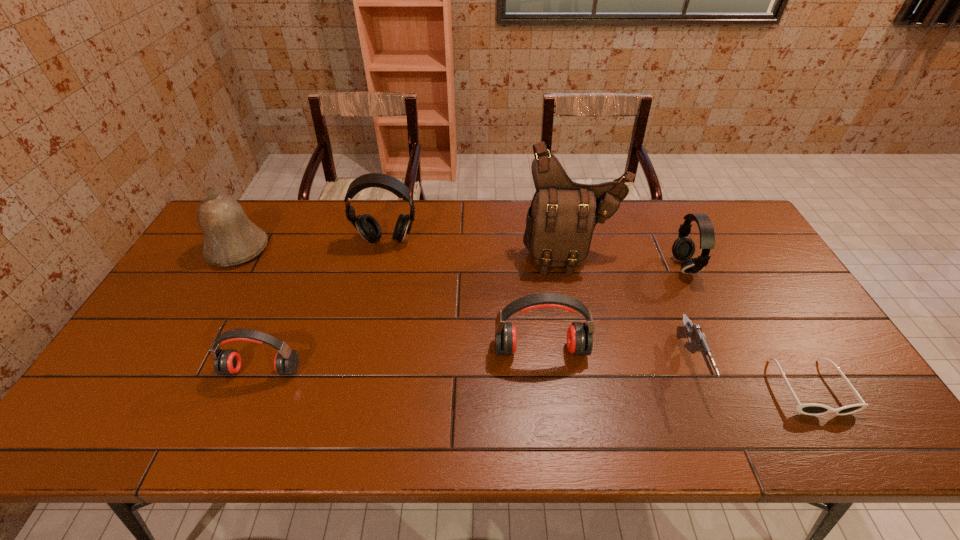
This screenshot has height=540, width=960. Find the location of `the tallest object`. the tallest object is located at coordinates (560, 222).

Where is `shoulder bag`? This screenshot has width=960, height=540. shoulder bag is located at coordinates (560, 222).

In order to click on the bigger black earphone in this screenshot , I will do coord(368,227).

Find the location of `the sixth object from right to left`. the sixth object from right to left is located at coordinates (368, 227).

At what (x,y) coordinates should I click in order to perform the action: click on the leftmost object. Please return your answer as a coordinate pair (x, y). This screenshot has width=960, height=540. Looking at the image, I should click on (230, 238).

This screenshot has height=540, width=960. I want to click on the third earphone from left to right, so click(579, 335).

What are the coordinates of `the right red earphone` in the screenshot? It's located at (579, 335).

You are a GUI agent. You are given a task and a screenshot of the screen. Output one action in this format:
    pyautogui.click(x=<x>, y=<y>)
    Task: Click on the smaller black earphone
    The width and height of the screenshot is (960, 540).
    Given the screenshot: What is the action you would take?
    pyautogui.click(x=683, y=248)

Identify the location of the rightmost earphone. (683, 248).

Where is `the smaller red earphone`? The width and height of the screenshot is (960, 540). the smaller red earphone is located at coordinates (227, 362).